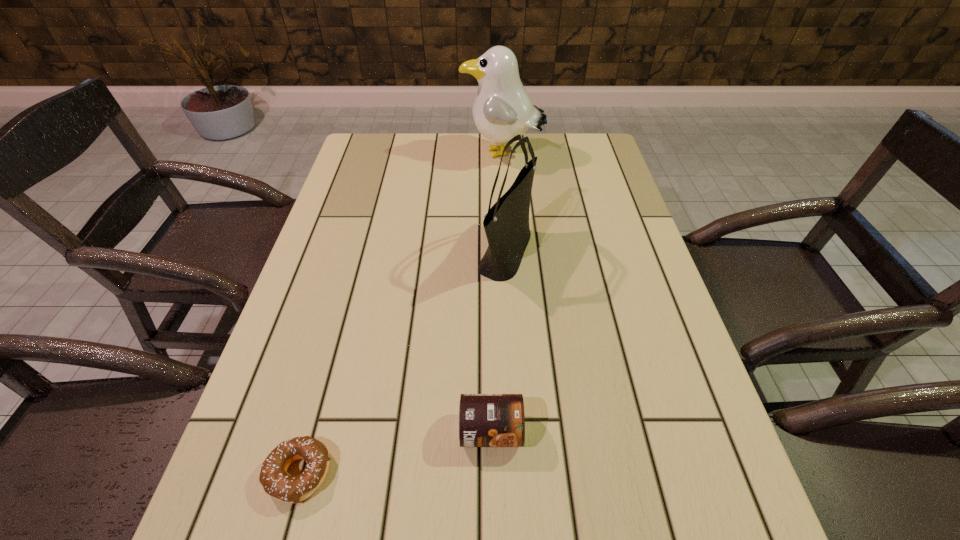
Find the location of `the farthest object`. the farthest object is located at coordinates (502, 109).

Locate an element on the screen. shoulder bag is located at coordinates (506, 224).

Find the location of a particular element. can is located at coordinates (485, 420).

Image resolution: width=960 pixels, height=540 pixels. I want to click on the shortest object, so click(x=276, y=482).

The image size is (960, 540). What are the coordinates of `the leftmost object` in the screenshot? It's located at (276, 482).

Identify the location of free space located on the beak of the gull. The height and width of the screenshot is (540, 960). (427, 155).

I want to click on free region located 0.300m on the beak of the gull, so click(x=369, y=155).

This screenshot has width=960, height=540. What are the coordinates of `vacant area situated on the beak of the gull` in the screenshot? It's located at (381, 155).

Find the location of a particular element. vacant space situated on the back of the shoulder bag is located at coordinates (500, 150).

Image resolution: width=960 pixels, height=540 pixels. Identify the location of vacant region located on the front label of the second shortest object. (492, 486).